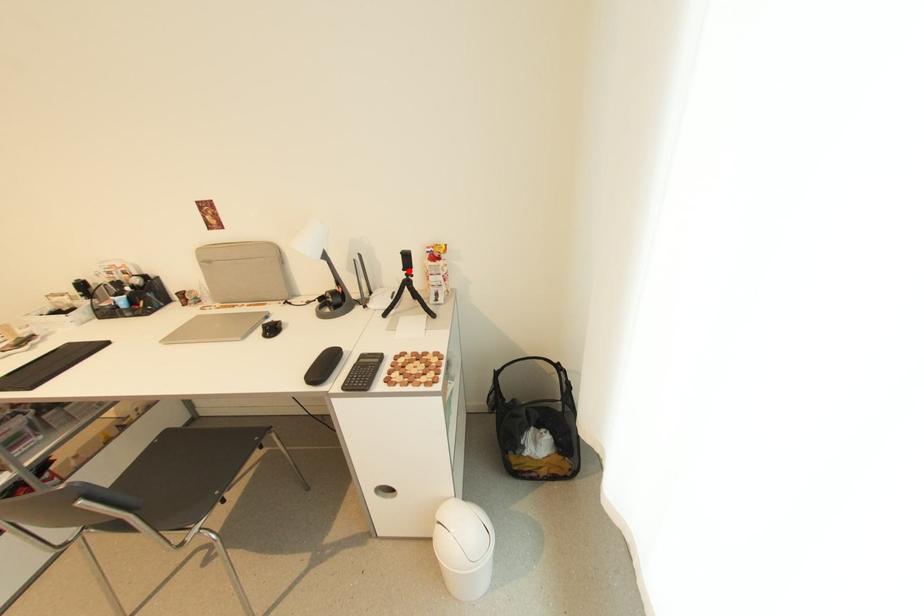
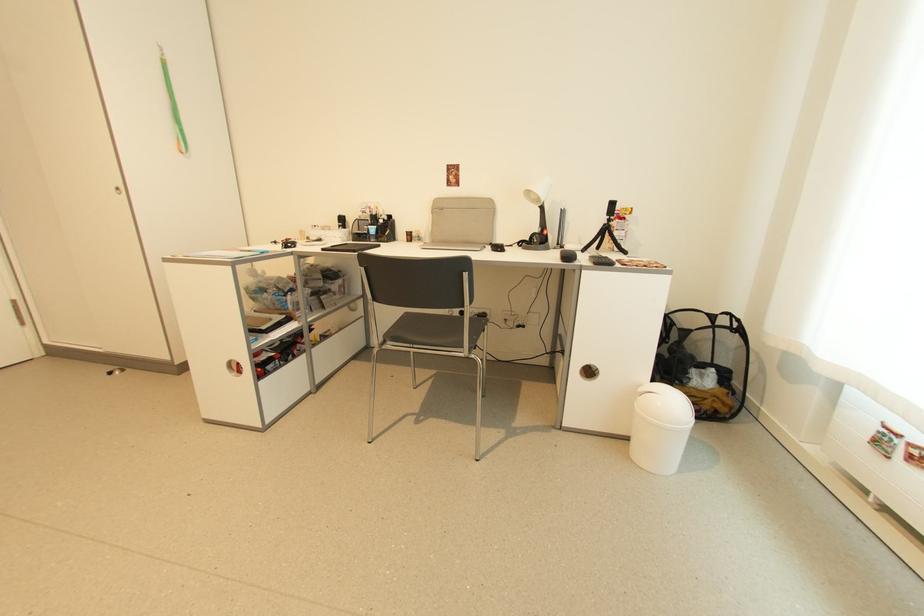
Locate, in the second image, the point that corresponds to the highlighted location in the first image.

(612, 217)